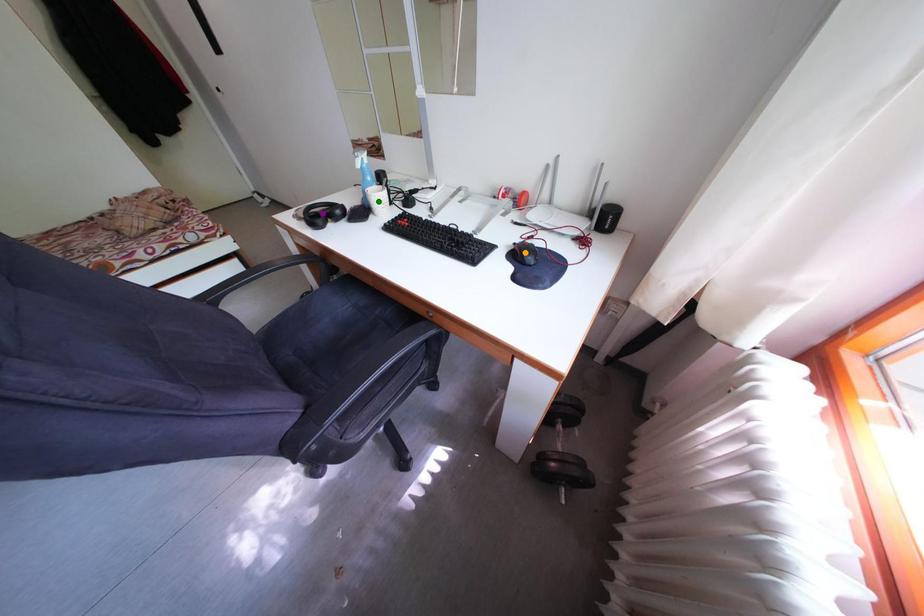
Order these from farthest to nearest:
green point
purple point
orange point

purple point < green point < orange point